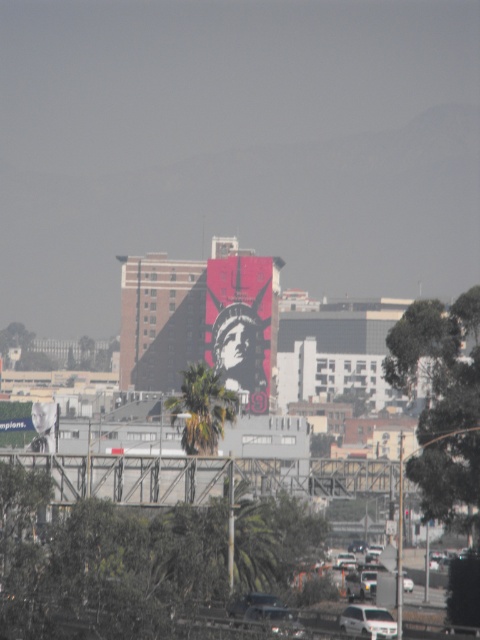
You are a GUI agent. You are given a task and a screenshot of the screen. Output one action in this format:
    pyautogui.click(x=<x>, y=<y>)
    Task: Click on the stained glass statue at center
    This screenshot has height=640, width=480.
    Given the screenshot: What is the action you would take?
    pyautogui.click(x=240, y=324)

The width and height of the screenshot is (480, 640). What do you see at coordinates (240, 324) in the screenshot?
I see `stained glass statue at center` at bounding box center [240, 324].

The height and width of the screenshot is (640, 480). I want to click on stained glass statue at center, so click(240, 324).

Does green leafy palm tree at center appear over white matte car at lower center?

Correct, green leafy palm tree at center is located above white matte car at lower center.

Who is more forward, (176, 412) or (384, 634)?

Point (384, 634)

This screenshot has width=480, height=640. What are the coordinates of `green leafy palm tree at center` in the screenshot? It's located at (203, 408).

Who is lower down, stained glass statue at center or green leafy palm tree at center?

green leafy palm tree at center is below.

Is point (263, 340) closer to camera compared to point (192, 372)?

No, (263, 340) is behind (192, 372).

Locate an element on the screen. This screenshot has height=640, width=480. stained glass statue at center is located at coordinates (x=240, y=324).